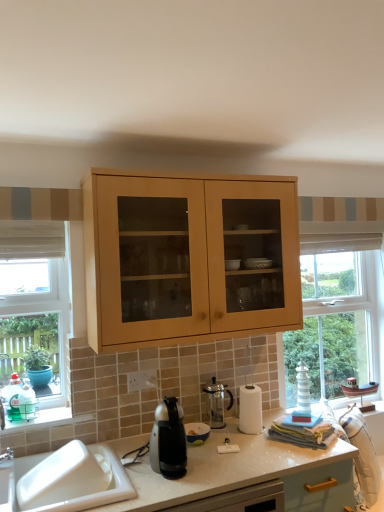
The width and height of the screenshot is (384, 512). Find the location of `free space in front of matte black coffee maker at center, arranged as the first appliance when viewed from the front`. free space in front of matte black coffee maker at center, arranged as the first appliance when viewed from the front is located at coordinates [201, 458].